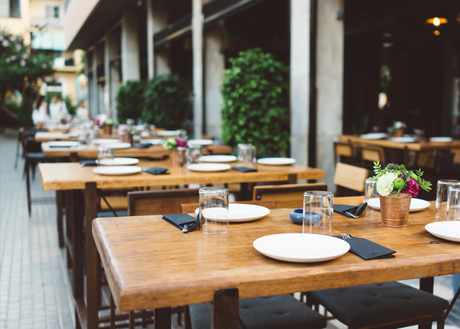
Find the location of a particular element. The width and height of the screenshot is (460, 329). wood tables is located at coordinates (166, 267), (65, 167), (53, 154), (41, 139), (398, 145).